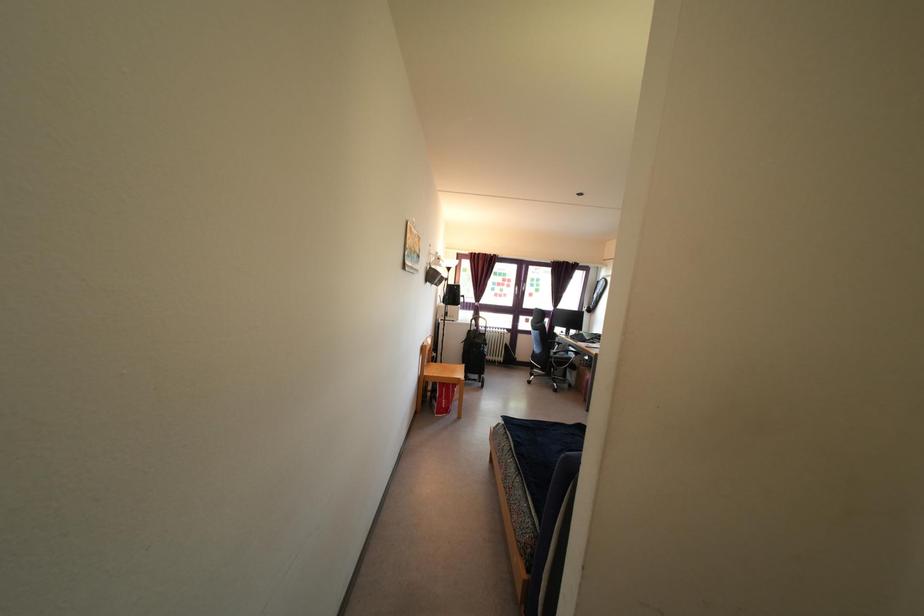
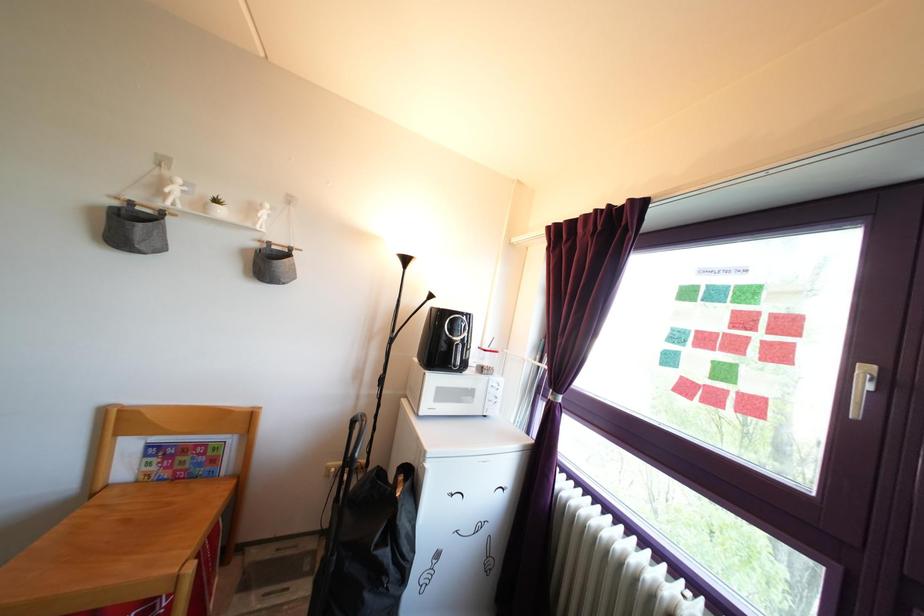
Find the pixel in the second image that matches [508,292] in the first image.

(761, 345)